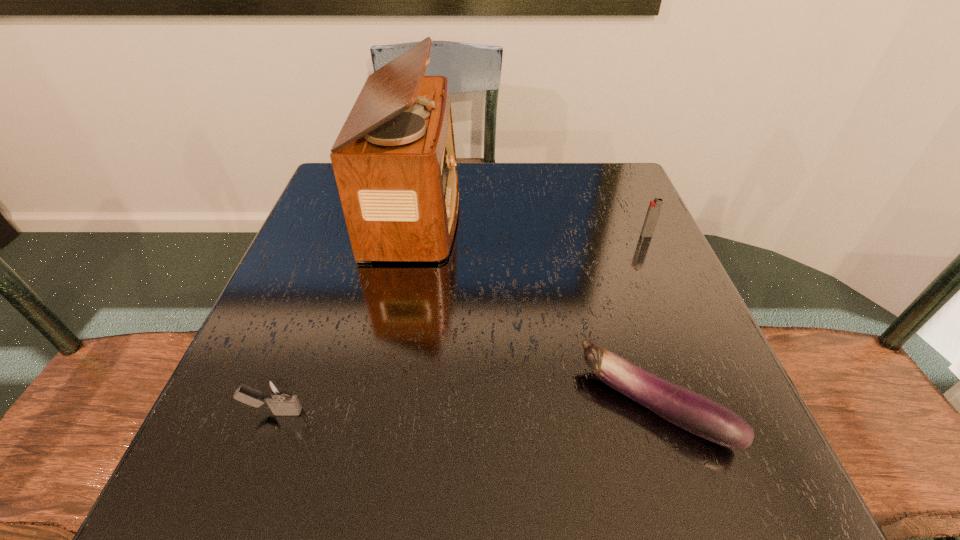
Locate an element on the screen. This screenshot has width=960, height=540. vacant space that satisfies the following two spatial constraints: 1. on the front panel of the tallest object; 2. on the right side of the right igniter is located at coordinates (411, 235).

Identify the location of free space that satisfies the following two spatial constraints: 1. on the back side of the right igniter; 2. on the left side of the eggplant. (600, 235).